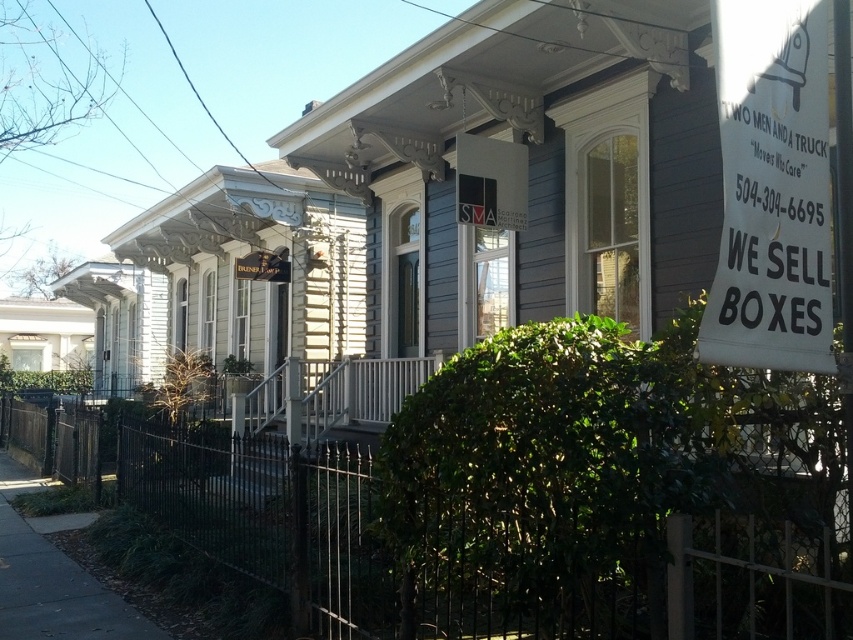
Is white paper sign at right wider than dark gray asphalt at lower left?

Incorrect, white paper sign at right's width does not surpass dark gray asphalt at lower left's.

Is white paper sign at right thinner than dark gray asphalt at lower left?

Indeed, white paper sign at right has a lesser width compared to dark gray asphalt at lower left.

Image resolution: width=853 pixels, height=640 pixels. In order to click on white paper sign at right in this screenshot , I will do `click(770, 188)`.